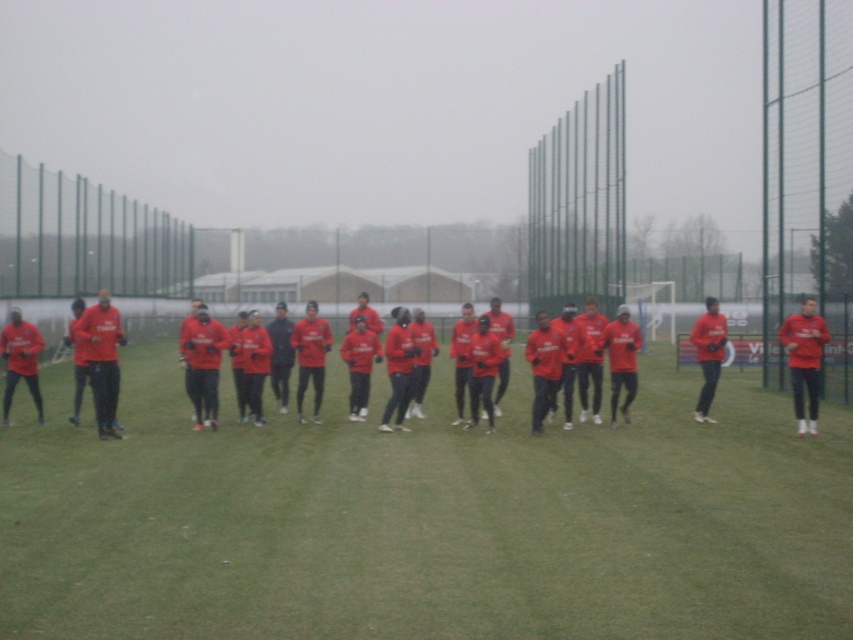
Question: Does matte red shirts at center appear under red matte jersey at center?

Choices:
 (A) no
 (B) yes

Answer: (B)

Question: Which of the following is the closest to the observer?

Choices:
 (A) matte red shirts at center
 (B) red matte jersey at center

Answer: (A)

Question: Which point is farther to the camera?

Choices:
 (A) red matte jersey at center
 (B) matte red shirts at center

Answer: (A)

Question: Observing the image, what is the correct spatial positioning of matte red shirts at center in reference to red matte jersey at center?

Choices:
 (A) right
 (B) left

Answer: (B)

Question: Can you confirm if matte red shirts at center is bigger than red matte jersey at center?

Choices:
 (A) no
 (B) yes

Answer: (A)